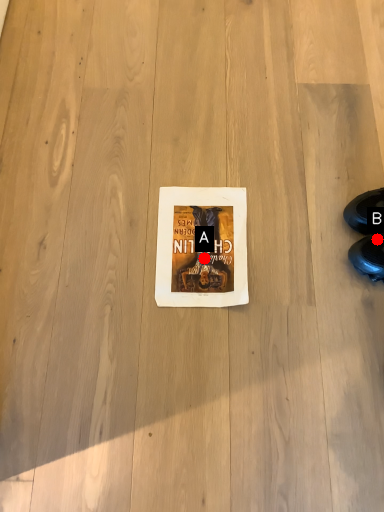
Question: Two points are circled on the image, labeled by A and B beside each circle. Which point is farther from the camera taking this photo?

Choices:
 (A) A is further
 (B) B is further

Answer: (A)